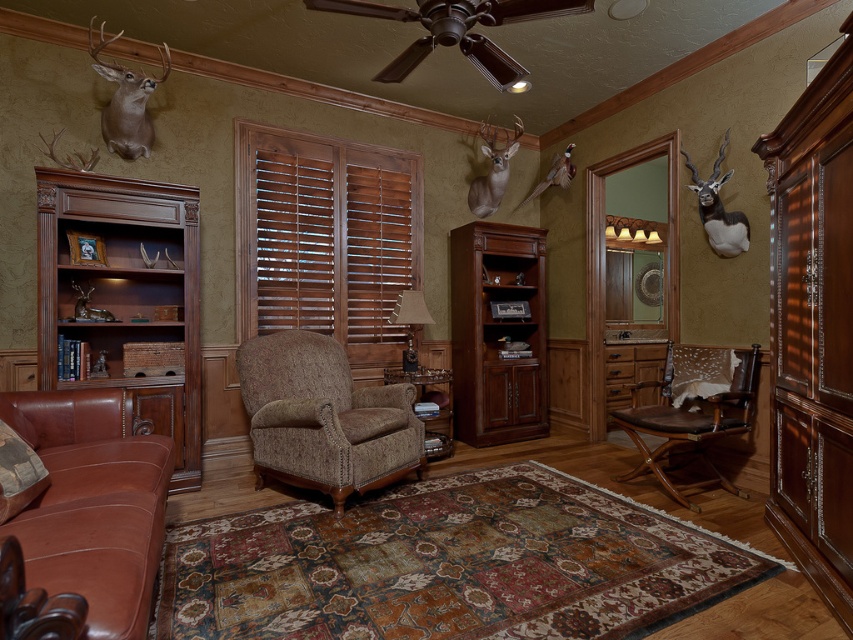
You are sitting on the brown leather armchair at lower right and want to reach the mahogany wood bookshelf at center. In which direction should you move to get there?

The mahogany wood bookshelf at center is to the left of the brown leather armchair at lower right, so you should move to your left to reach it.

You are a visitor in this room and want to know which object is taller between the mahogany wood bookshelf at center and the brown leather armchair at lower right. Can you tell me?

The mahogany wood bookshelf at center is much taller than the brown leather armchair at lower right.